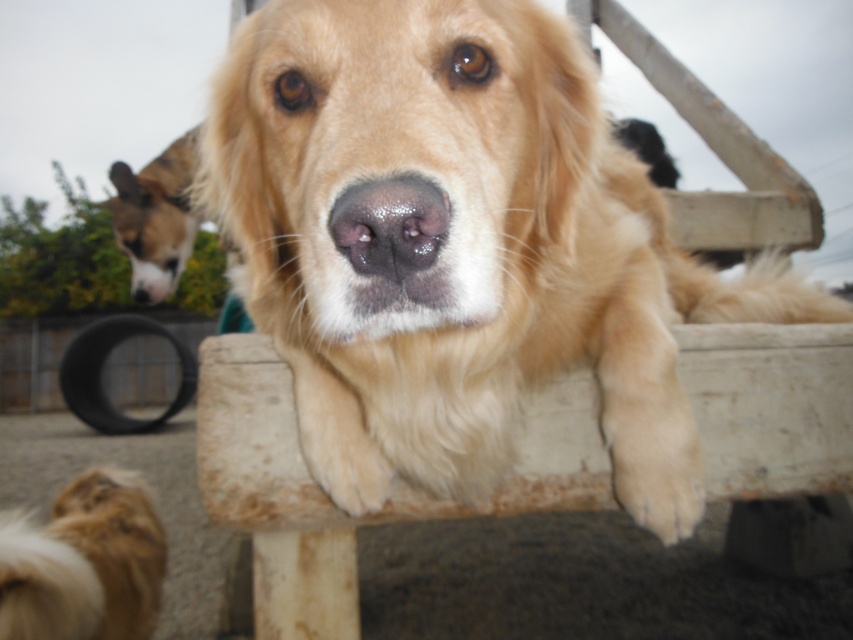
Question: Which point is farther to the camera?

Choices:
 (A) brown fur dog at left
 (B) fuzzy brown fur at lower left

Answer: (A)

Question: Can you confirm if fuzzy brown fur at lower left is smaller than brown fur dog at left?

Choices:
 (A) no
 (B) yes

Answer: (B)

Question: Which object is positioned farthest from the golden retriever at center?

Choices:
 (A) fuzzy brown fur at lower left
 (B) brown fur dog at left

Answer: (B)

Question: Does golden retriever at center appear on the left side of fuzzy brown fur at lower left?

Choices:
 (A) no
 (B) yes

Answer: (A)

Question: Can you confirm if fuzzy brown fur at lower left is positioned to the left of brown fur dog at left?

Choices:
 (A) no
 (B) yes

Answer: (A)

Question: Which of the following is the closest to the observer?

Choices:
 (A) (637, 387)
 (B) (134, 188)
 (C) (149, 634)

Answer: (A)